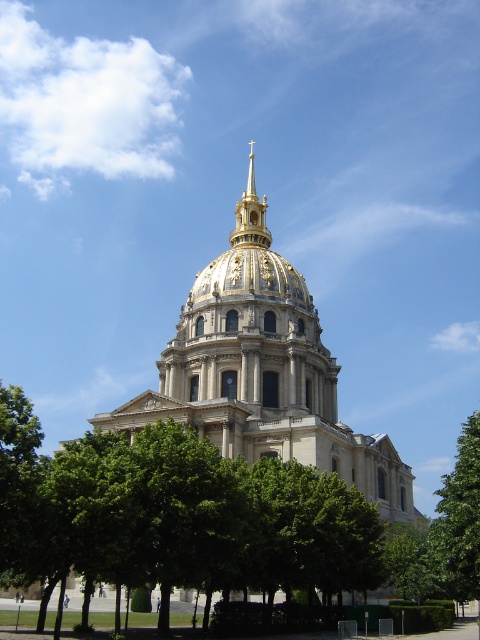
Between green leafy tree at center and beige stone dome at center, which one has more height?

beige stone dome at center

Which is below, green leafy tree at center or beige stone dome at center?

green leafy tree at center is lower down.

Between point (204, 548) and point (225, 388), which one is positioned behind?

The point (225, 388) is behind.

This screenshot has height=640, width=480. I want to click on green leafy tree at center, so click(x=173, y=515).

Does green leafy tree at center have a lesser width compared to green leafy tree at right?

Correct, green leafy tree at center's width is less than green leafy tree at right's.

Does point (58, 564) lie in front of point (443, 582)?

Yes, point (58, 564) is in front of point (443, 582).

The height and width of the screenshot is (640, 480). Find the location of `green leafy tree at center`. green leafy tree at center is located at coordinates (173, 515).

Between point (267, 291) and point (252, 189), which one is positioned behind?

Positioned behind is point (252, 189).

Locate an element on the screen. This screenshot has height=640, width=480. beige stone dome at center is located at coordinates (263, 380).